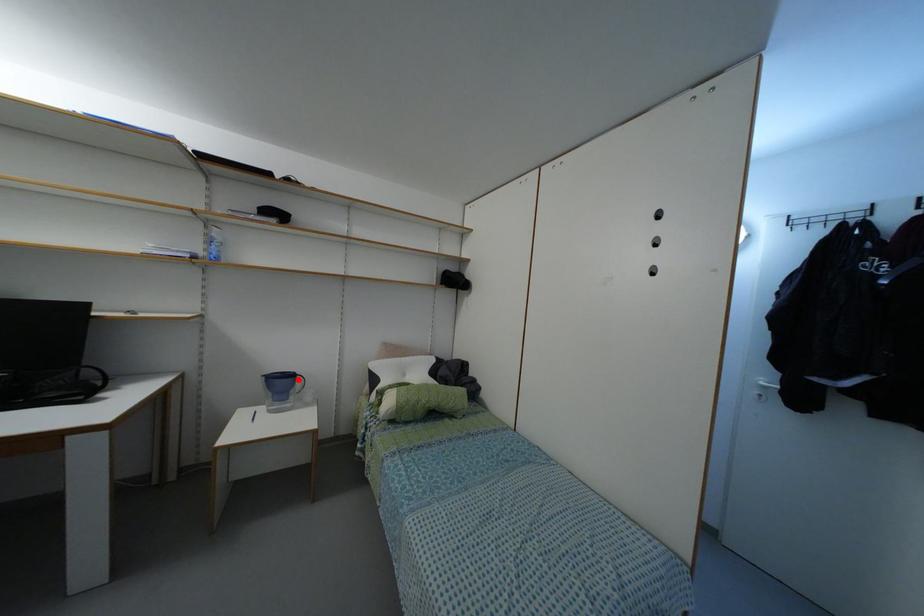
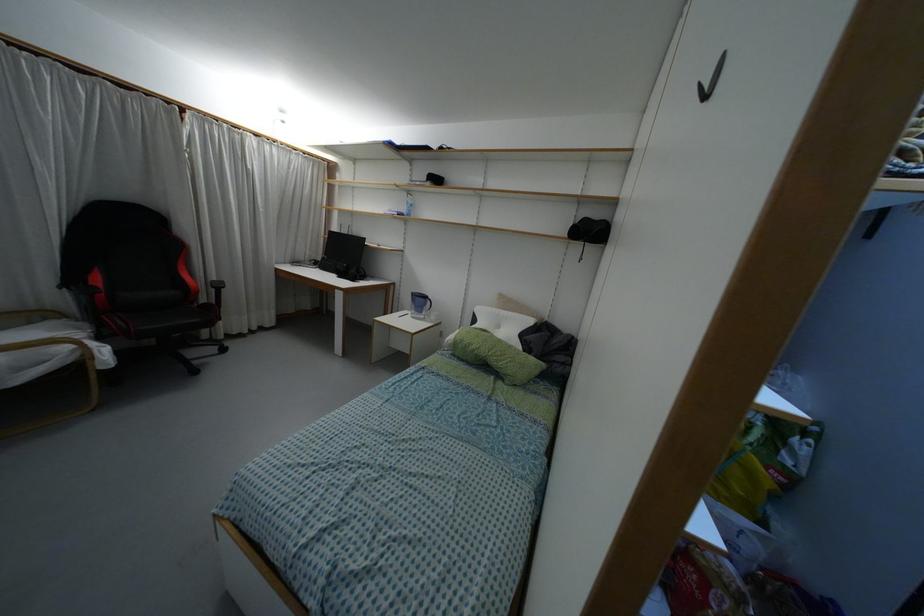
Question: A red point is marked in image1. In image2, is the corresponding 3D point closer to the camera or farther? Reply with the corresponding letter.

Choices:
 (A) The corresponding 3D point is closer.
 (B) The corresponding 3D point is farther.

Answer: (B)